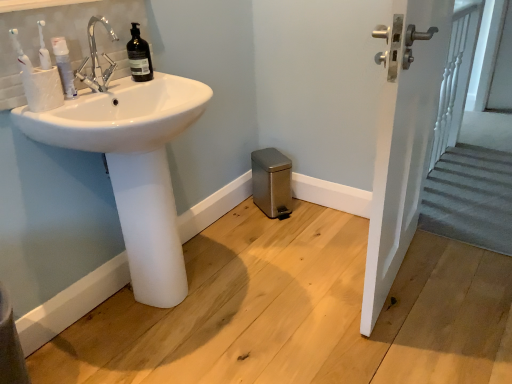
Find the location of a particular element. Image resolution: width=512 pixels, height=384 pixels. free space between white glossy door handle at upper right and white glossy sink at left is located at coordinates (282, 281).